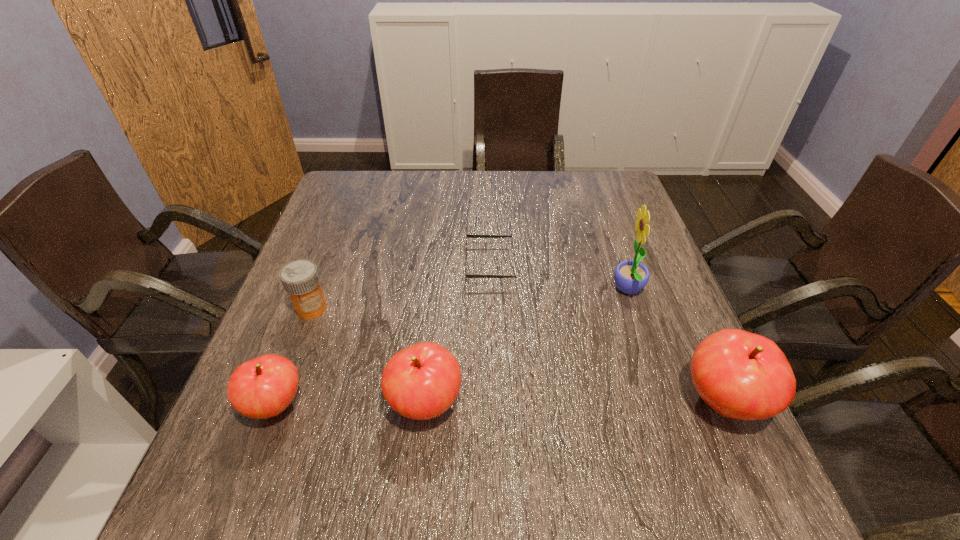
At what (x,y) coordinates should I click in order to perform the action: click on the leftmost apple. Please return your answer as a coordinate pair (x, y). This screenshot has width=960, height=540. Looking at the image, I should click on (263, 387).

This screenshot has width=960, height=540. Find the location of `the second shortest apple`. the second shortest apple is located at coordinates (421, 381).

This screenshot has width=960, height=540. Identify the location of the third tallest object. (421, 381).

At what (x,y) coordinates should I click in order to perform the action: click on the rightmost apple. Please return your answer as a coordinate pair (x, y). The height and width of the screenshot is (540, 960). Looking at the image, I should click on [741, 375].

I want to click on sunglasses, so click(467, 236).

At what (x,y) coordinates should I click in order to perform the action: click on medicine. Please return your answer as a coordinate pair (x, y). Looking at the image, I should click on (300, 278).

Where is `sunflower`? sunflower is located at coordinates (630, 277).

Find the location of a particular element. This screenshot has width=960, height=540. blank area located 0.160m on the back of the leftmost apple is located at coordinates (308, 318).

The height and width of the screenshot is (540, 960). What are the coordinates of `vacant space located on the back of the third tallest object` in the screenshot? It's located at (437, 286).

Where is `free space located 0.400m on the back of the rightmost apple`? The height and width of the screenshot is (540, 960). free space located 0.400m on the back of the rightmost apple is located at coordinates (651, 243).